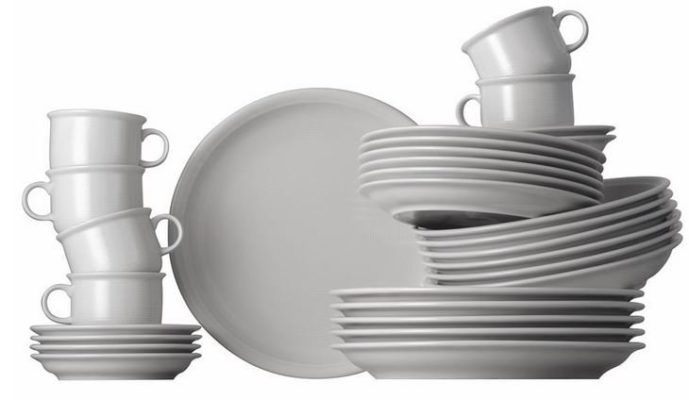
Where is `cup handles`? cup handles is located at coordinates (52, 291), (169, 216), (161, 159), (28, 187), (566, 11), (469, 99).